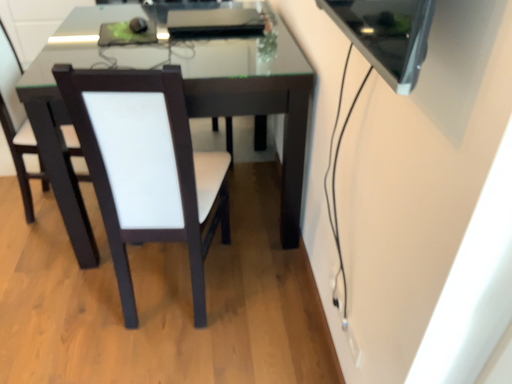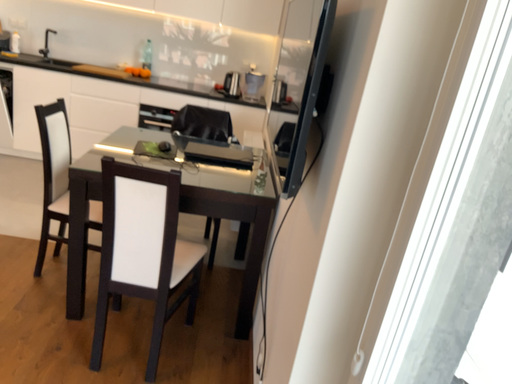
Question: Which way did the camera rotate in the video?

Choices:
 (A) rotated downward
 (B) rotated upward

Answer: (B)